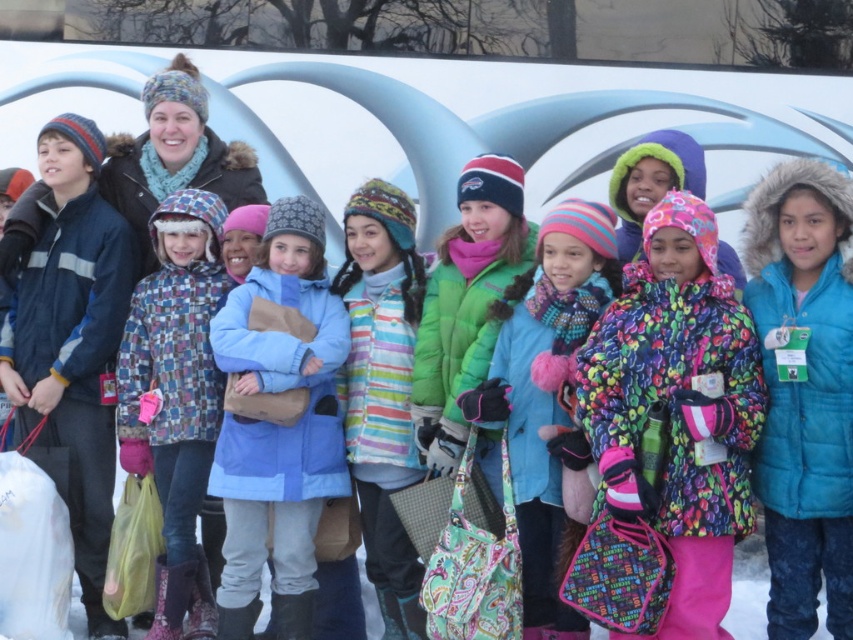
Does point (225, 326) come farther from viewer compared to point (520, 358)?

Yes.

Is light blue fabric coat at center above fluffy pink mittens at center?

No.

Which is in front, point (320, 212) or point (547, 321)?

Point (547, 321) is in front.

This screenshot has height=640, width=853. In order to click on light blue fabric coat at center in this screenshot , I will do `click(277, 422)`.

Can you confirm if multicolored fleece jacket at center is taller than striped fleece jacket at center?

No, multicolored fleece jacket at center is not taller than striped fleece jacket at center.

Can you confirm if multicolored fleece jacket at center is bigger than striped fleece jacket at center?

Yes, multicolored fleece jacket at center is bigger than striped fleece jacket at center.

At what (x,y) coordinates should I click in order to perform the action: click on multicolored fleece jacket at center. Please return your answer as a coordinate pair (x, y). The image size is (853, 640). Looking at the image, I should click on (676, 413).

Find the location of `multicolored fleece jacket at center`. multicolored fleece jacket at center is located at coordinates (676, 413).

Is multicolored fleece jacket at center closer to the viewer compared to light blue fabric coat at center?

Yes, it is.

Is point (611, 362) closer to camera compared to point (236, 340)?

Yes, point (611, 362) is in front of point (236, 340).

Between point (691, 554) and point (312, 588), which one is positioned in front?

Point (691, 554)

What are the coordinates of `multicolored fleece jacket at center` in the screenshot? It's located at [676, 413].